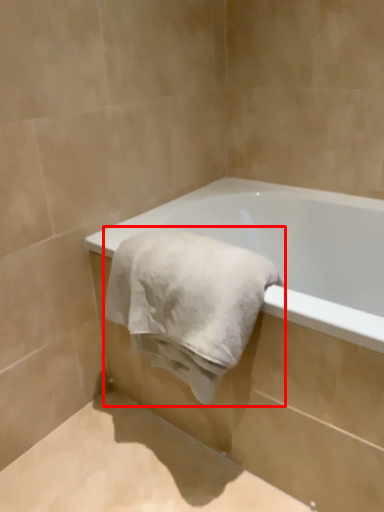
Question: From the image's perspective, what is the correct spatial positioning of towel (annotated by the red box) in reference to bathtub?

Choices:
 (A) above
 (B) below

Answer: (A)